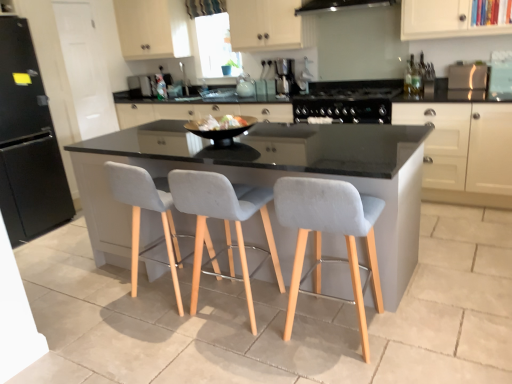
Question: In the image, is light gray fabric chair at center, the 3th chair when ordered from right to left, on the left side or the right side of light gray fabric chair at center, which appears as the third chair when viewed from the left?

Choices:
 (A) left
 (B) right

Answer: (A)

Question: From the image's perspective, is light gray fabric chair at center, the 3th chair when ordered from right to left, above or below light gray fabric chair at center, which is counted as the first chair, starting from the right?

Choices:
 (A) above
 (B) below

Answer: (A)

Question: Estimate the real-world distances between objects in this image. Which object is closer to the metallic silver kettle at upper center, which is the first appliance in back-to-front order?

Choices:
 (A) light gray fabric chair at center, the 2th chair in the left-to-right sequence
 (B) white matte cabinet at upper right
 (C) satin silver coffee machine at upper center
 (D) light gray fabric chair at center, which is counted as the first chair, starting from the right
 (E) black matte refrigerator at left, arranged as the fourth appliance when viewed from the back

Answer: (C)

Question: Which of these objects is positioned closest to the black glossy bowl at center, which is the 5th appliance in back-to-front order?

Choices:
 (A) light gray fabric chair at center, which ranks as the second chair in right-to-left order
 (B) white matte cabinet at upper right
 (C) light gray fabric chair at center, which appears as the 1th chair when viewed from the left
 (D) black glass gas stove at center
 (E) black matte refrigerator at left, which is the 5th appliance in right-to-left order

Answer: (A)